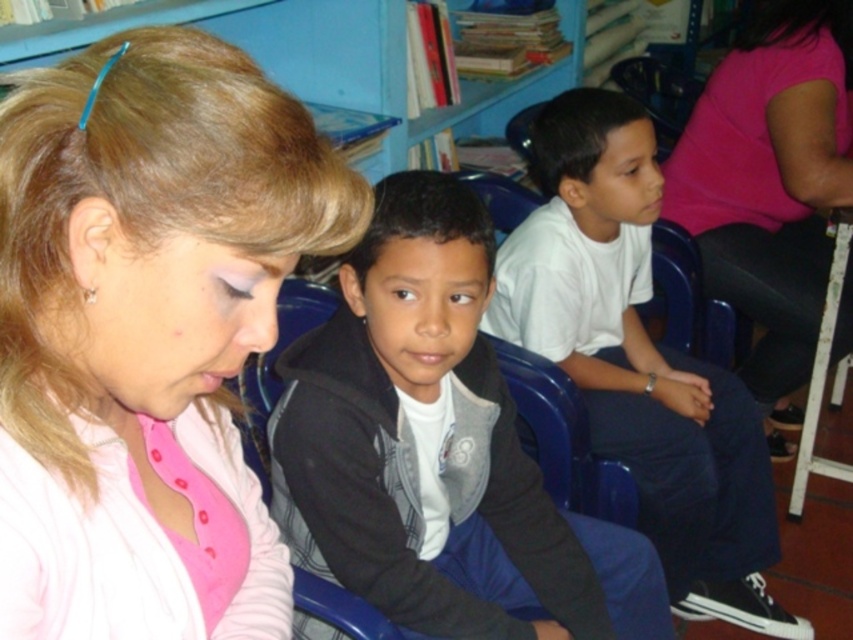
You are a photographer setting up a shoot in this classroom. You need to position a light to the right of both the matte black hoodie at center and the white matte shirt at center. Based on their current positions, where should you place the light?

The matte black hoodie at center is to the left of white matte shirt at center, so placing the light to the right of both would mean positioning it to the right side of the white matte shirt at center.

You are observing a woman in a classroom setting. She is wearing a pink cardigan over a pink top. You notice two objects labeled as pink fabric at center and white matte shirt at center. Which of these is positioned higher on her body?

The pink fabric at center is positioned higher on her body than the white matte shirt at center.